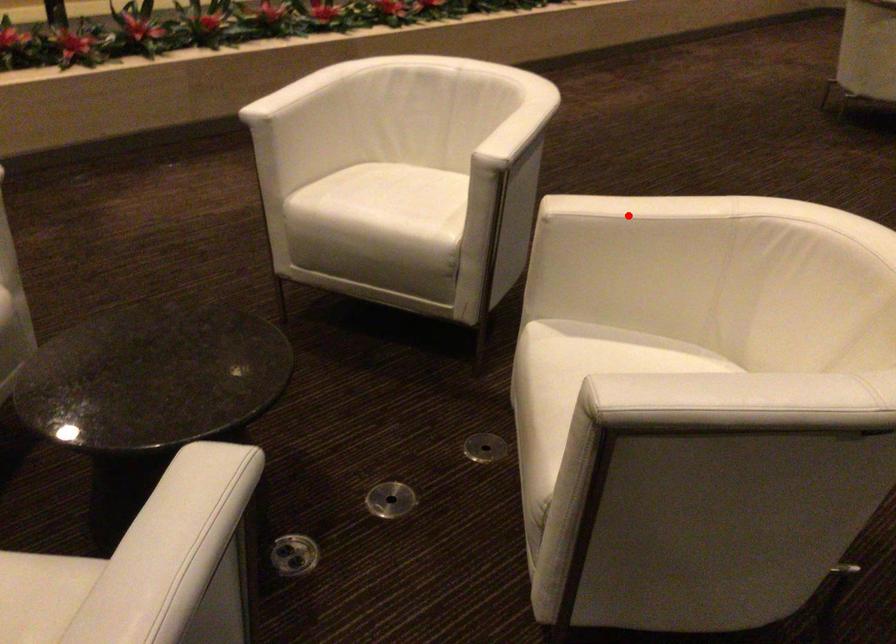
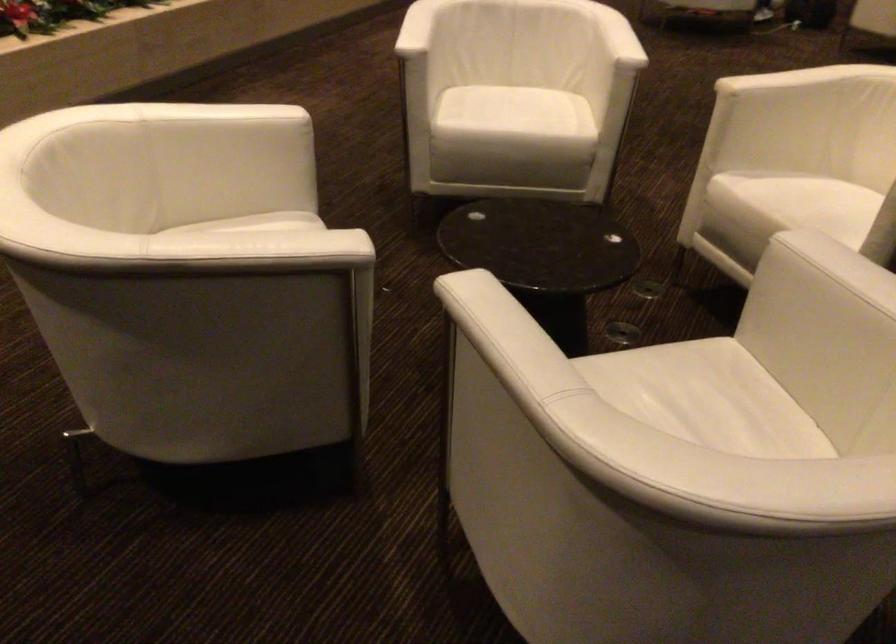
Question: I am providing you with two images of the same scene from different viewpoints. A red point is marked on the first image. At the location where the point appears in image 1, is it still visible in image 2?

Choices:
 (A) Yes
 (B) No

Answer: (A)